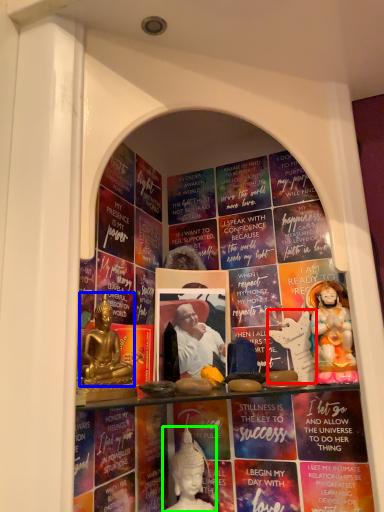
Question: Which is nearer to the sculpture (highlighted by a red box)? person (highlighted by a blue box) or person (highlighted by a green box).

Choices:
 (A) person
 (B) person

Answer: (B)